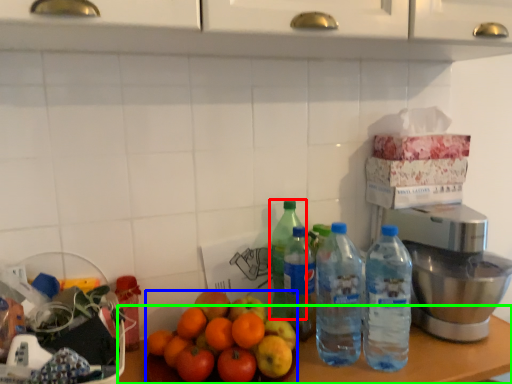
Question: Considering the real-world distances, which object is closest to bottle (highlighted by a red box)? orange (highlighted by a blue box) or table (highlighted by a green box).

Choices:
 (A) orange
 (B) table

Answer: (A)